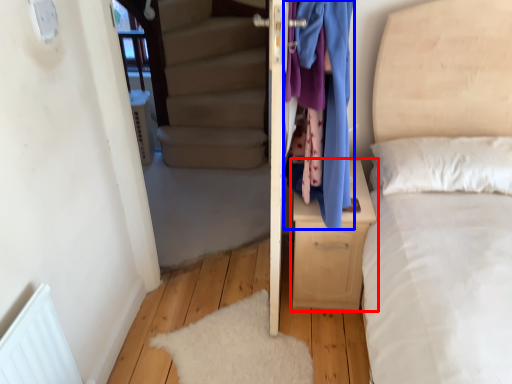
Question: Which object is further to the camera taking this photo, nightstand (highlighted by a red box) or clothing (highlighted by a blue box)?

Choices:
 (A) nightstand
 (B) clothing

Answer: (A)